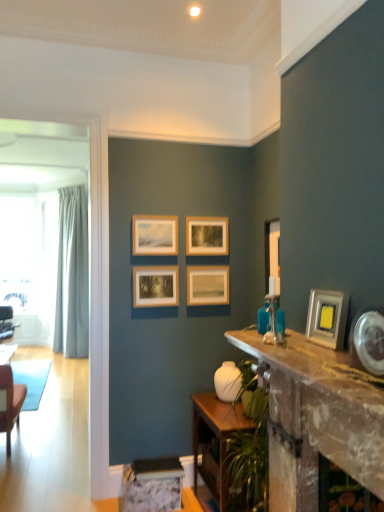
Question: From the image's perspective, is metallic silver picture frame at right, positioned as the 1th picture frame in front-to-back order, above wooden table at lower center, which is the 2th table in top-to-bottom order?

Choices:
 (A) yes
 (B) no

Answer: (A)

Question: Can we say metallic silver picture frame at right, the 6th picture frame from the back, lies outside wooden table at lower center, which is the 2th table in top-to-bottom order?

Choices:
 (A) yes
 (B) no

Answer: (A)

Question: Is metallic silver picture frame at right, the 6th picture frame from the back, smaller than wooden table at lower center, which is the 2th table in top-to-bottom order?

Choices:
 (A) yes
 (B) no

Answer: (A)

Question: From a real-world perspective, is metallic silver picture frame at right, the 6th picture frame from the back, positioned under wooden table at lower center, which is counted as the 1th table, starting from the back, based on gravity?

Choices:
 (A) no
 (B) yes

Answer: (A)

Question: Is the position of metallic silver picture frame at right, positioned as the 1th picture frame in front-to-back order, more distant than that of wooden table at lower center, which is the first table in bottom-to-top order?

Choices:
 (A) yes
 (B) no

Answer: (B)

Question: From the image's perspective, relative to wooden picture frame at center, which is counted as the 5th picture frame, starting from the front, is matte black chair at left above or below?

Choices:
 (A) below
 (B) above

Answer: (A)

Question: From a real-world perspective, is matte black chair at left positioned above or below wooden picture frame at center, which is counted as the 5th picture frame, starting from the front?

Choices:
 (A) above
 (B) below

Answer: (B)

Question: Considering the positions of matte black chair at left and wooden picture frame at center, arranged as the second picture frame when viewed from the back, in the image, is matte black chair at left taller or shorter than wooden picture frame at center, arranged as the second picture frame when viewed from the back,?

Choices:
 (A) tall
 (B) short

Answer: (A)

Question: Is matte black chair at left in front of or behind wooden picture frame at center, arranged as the second picture frame when viewed from the back, in the image?

Choices:
 (A) front
 (B) behind

Answer: (B)

Question: Based on their sizes in the image, would you say rustic wooden table at center, which is the 1th table from top to bottom, is bigger or smaller than wooden picture frame at center, which ranks as the fourth picture frame in back-to-front order?

Choices:
 (A) big
 (B) small

Answer: (A)

Question: From a real-world perspective, is rustic wooden table at center, the 2th table positioned from the bottom, positioned above or below wooden picture frame at center, the third picture frame from the front?

Choices:
 (A) below
 (B) above

Answer: (A)

Question: In the image, is rustic wooden table at center, the 2th table positioned from the bottom, positioned in front of or behind wooden picture frame at center, the third picture frame from the front?

Choices:
 (A) front
 (B) behind

Answer: (A)

Question: From the image's perspective, relative to wooden picture frame at center, the third picture frame from the front, is rustic wooden table at center, placed as the second table when sorted from back to front, above or below?

Choices:
 (A) below
 (B) above

Answer: (A)

Question: Looking at the image, does wooden picture frame at center, arranged as the second picture frame when viewed from the back, seem bigger or smaller compared to white glossy vase at center?

Choices:
 (A) small
 (B) big

Answer: (A)

Question: Do you think wooden picture frame at center, arranged as the second picture frame when viewed from the back, is within white glossy vase at center, or outside of it?

Choices:
 (A) outside
 (B) inside

Answer: (A)